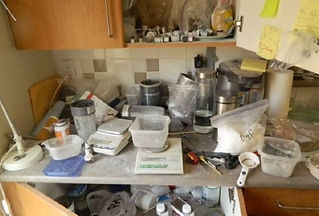
The image size is (319, 216). In order to click on open cabinets in this screenshot , I will do `click(190, 11)`, `click(142, 206)`.